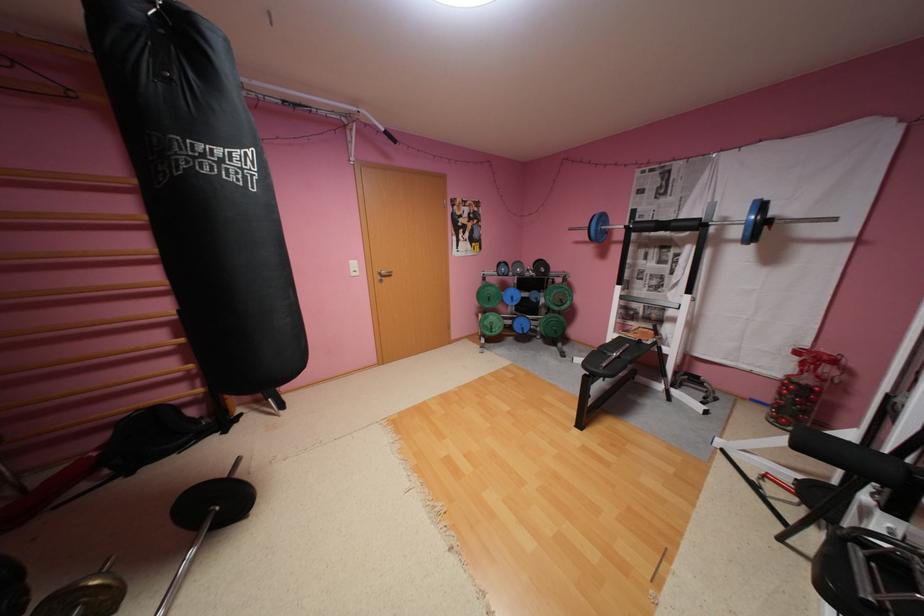
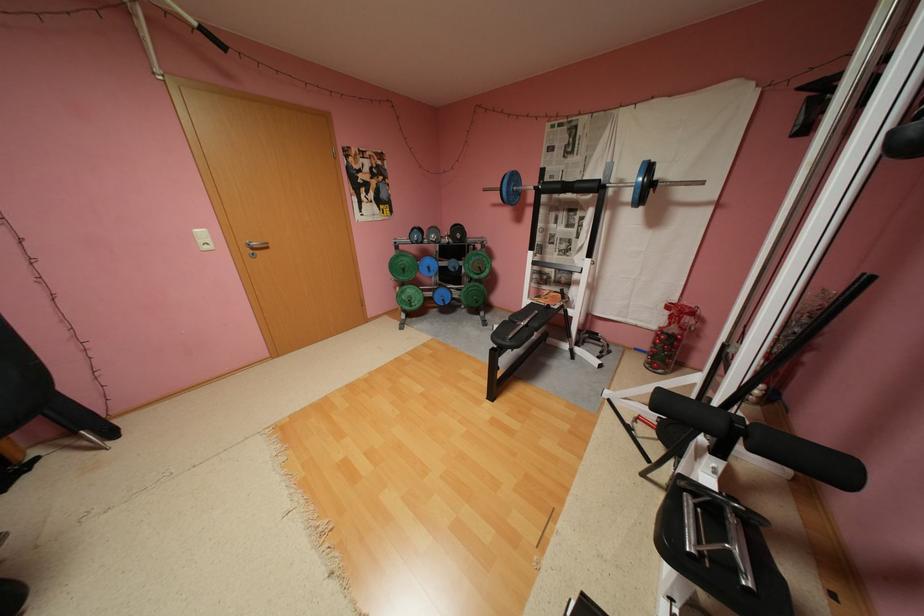
Locate, in the second image, the point that corresponds to point 391,276 in the first image.

(262, 249)